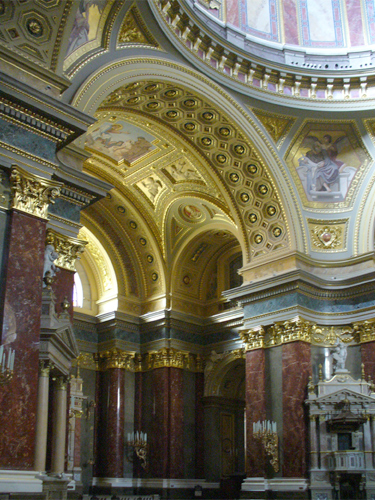
Locate an element on the screen. window is located at coordinates click(x=77, y=290).